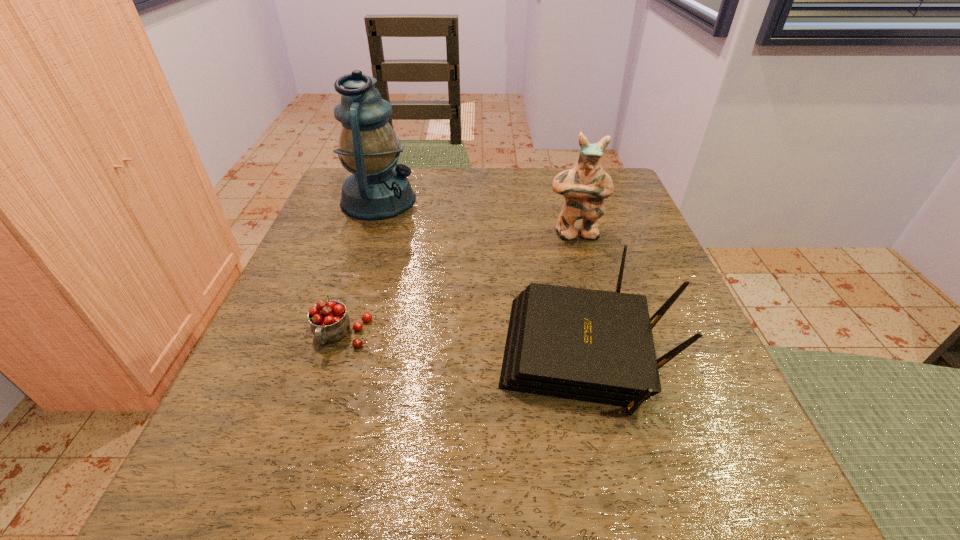
Locate an element on the screen. This screenshot has height=540, width=960. free space between the cherry and the tallest object is located at coordinates (360, 268).

I want to click on free space that is in between the lantern and the third shortest object, so click(x=477, y=217).

Where is `vacant space that's between the tallest object and the figurine`? vacant space that's between the tallest object and the figurine is located at coordinates (477, 217).

Image resolution: width=960 pixels, height=540 pixels. In order to click on blank region between the shortest object and the figurine in this screenshot , I will do `click(458, 285)`.

This screenshot has height=540, width=960. In order to click on free space that is in between the cherry and the third tallest object in this screenshot , I will do `click(464, 347)`.

Find the location of a particular element. The height and width of the screenshot is (540, 960). blank region between the tallest object and the third shortest object is located at coordinates (477, 217).

Locate an element on the screen. The height and width of the screenshot is (540, 960). the third closest object relative to the figurine is located at coordinates (329, 321).

Select which object is the closest to the cherry. Please provide its 2D coordinates. Your answer should be formatted as a tuple, i.e. [(x, y)], where the tuple contains the x and y coordinates of a point satisfying the conditions above.

[(596, 346)]

In order to click on vacant space that satisfies the following two spatial constraints: 1. on the face of the router; 2. on the right side of the lantern in this screenshot , I will do `click(326, 357)`.

Locate an element on the screen. This screenshot has width=960, height=540. vacant region that satisfies the following two spatial constraints: 1. on the handle side of the second shortest object; 2. on the left side of the cherry is located at coordinates click(334, 357).